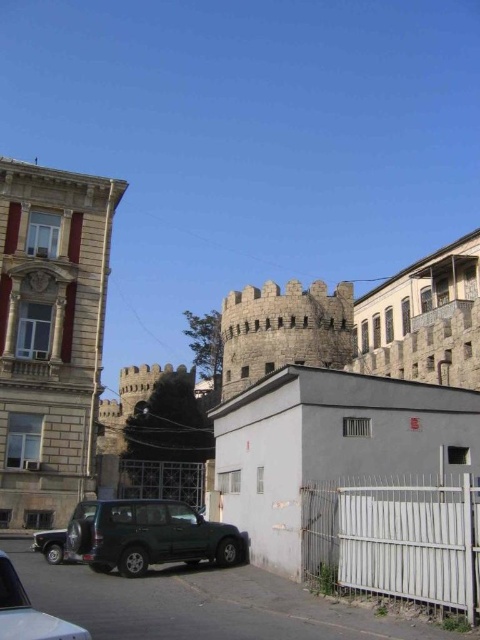
Question: Based on their relative distances, which object is nearer to the white metal fence at lower right?

Choices:
 (A) dark green matte suv at lower left
 (B) smooth stone tower at left
 (C) dark green matte suv at center

Answer: (C)

Question: Is smooth stone tower at left thinner than dark green matte suv at center?

Choices:
 (A) yes
 (B) no

Answer: (B)

Question: Considering the relative positions of smooth stone tower at left and dark green matte suv at lower left in the image provided, where is smooth stone tower at left located with respect to dark green matte suv at lower left?

Choices:
 (A) below
 (B) above

Answer: (B)

Question: Observing the image, what is the correct spatial positioning of smooth stone tower at left in reference to white metal fence at lower right?

Choices:
 (A) right
 (B) left

Answer: (B)

Question: Which point is farther to the camera?

Choices:
 (A) white metal fence at lower right
 (B) smooth stone tower at left

Answer: (B)

Question: Which point appears closest to the camera in this image?

Choices:
 (A) (100, 570)
 (B) (336, 572)
 (C) (4, 586)
 (D) (38, 250)

Answer: (C)